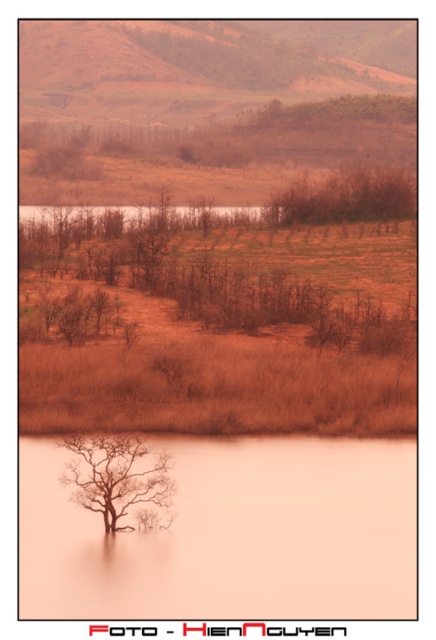
You are standing on the edge of the water in the image and want to walk to the brown matte tree at center. Which direction should you head to avoid the translucent orange flood at center?

You should head to the right to avoid the translucent orange flood at center, as it is to the left of the brown matte tree at center.

You are an explorer trying to cross the water to reach the other side. You see the brown grassland at center and the brown matte tree at lower center. Which direction should you head towards to avoid the tree?

You should head to the left of the brown matte tree at lower center because the brown grassland at center is located to the right of the tree, so moving left would avoid it.